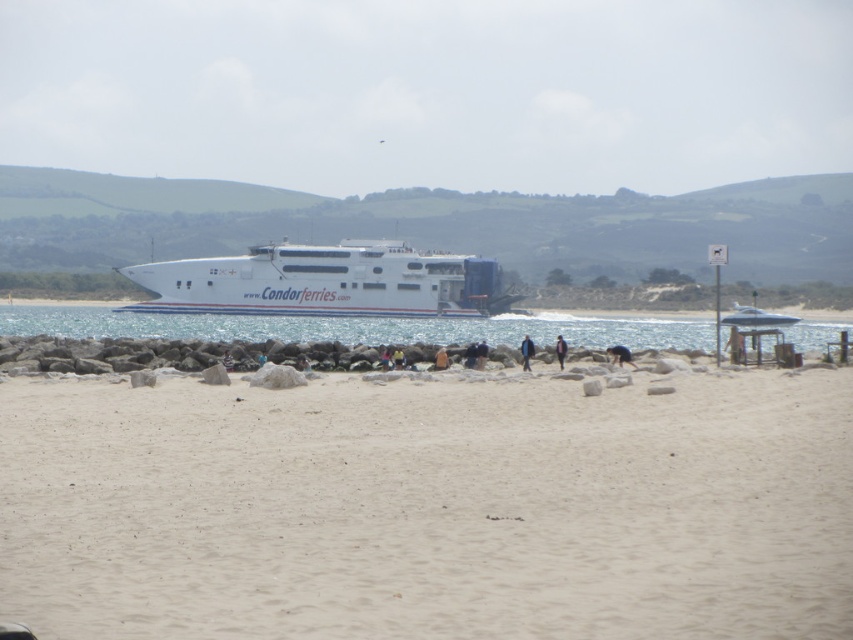
You are standing on the beach looking at the ferry. There are two points marked on the ferry. Which point is closer to you, point (525, 534) or point (398, 323)?

Point (525, 534) is closer to the viewer than point (398, 323).

Based on the photo, you are a photographer standing on the beach and want to capture both the white glossy water at center and the blue fabric jacket at center in your shot. Which object will take up more space in your photo?

The white glossy water at center is larger in size than the blue fabric jacket at center, so it will take up more space in the photo.